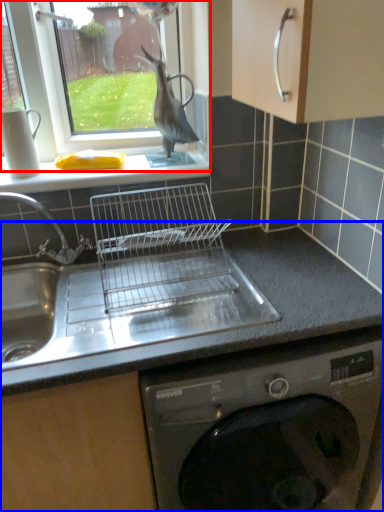
Question: Which object appears closest to the camera in this image, window (highlighted by a red box) or countertop (highlighted by a blue box)?

Choices:
 (A) window
 (B) countertop

Answer: (B)